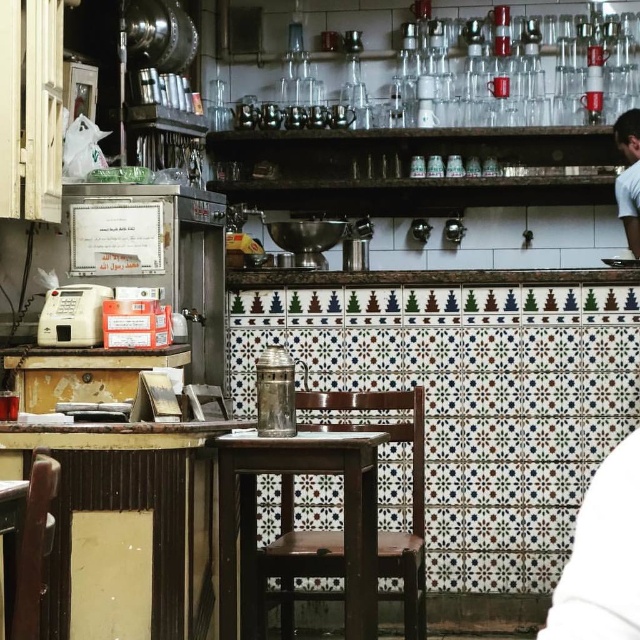
Question: Is wooden bar stool at center thinner than white fabric at lower right?

Choices:
 (A) yes
 (B) no

Answer: (B)

Question: Which of the following is the farthest from the observer?

Choices:
 (A) white fabric at lower right
 (B) wooden bar stool at center
 (C) white fabric shirt at upper right

Answer: (C)

Question: Which point is closer to the camera?

Choices:
 (A) (358, 572)
 (B) (611, 624)
 (C) (628, 230)

Answer: (B)

Question: Which point is closer to the camera?

Choices:
 (A) white fabric shirt at upper right
 (B) white fabric at lower right

Answer: (B)

Question: Does wooden bar stool at center have a lesser width compared to white fabric at lower right?

Choices:
 (A) yes
 (B) no

Answer: (B)

Question: Observing the image, what is the correct spatial positioning of wooden bar stool at center in reference to white fabric shirt at upper right?

Choices:
 (A) right
 (B) left

Answer: (B)